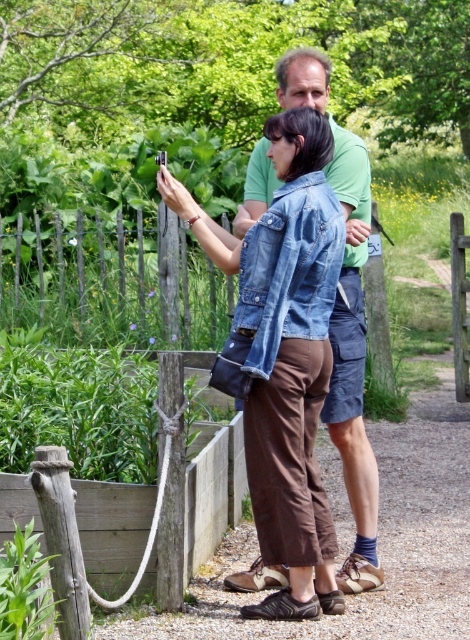
You are a photographer standing in the garden. You want to take a picture of the wooden fence at left without including the denim jacket at center in the shot. Is it possible to do so by moving to the left?

The wooden fence at left is positioned over denim jacket at center, meaning the fence is closer to the photographer. Moving to the left would bring the photographer closer to the fence, but since the fence is already in front of the denim jacket, it might still block the view. However, since the fence is at the left, moving further left could allow the photographer to frame the shot so the fence is visible without the jacket in the frame. It depends on the angle and distance. The answer isn

You are planning to hang a picture frame on the wooden fence at left. The frame is as tall as the denim jacket at lower right. Will the frame fit vertically on the fence without overlapping the top edge?

The wooden fence at left is above the denim jacket at lower right, meaning the fence is taller than the denim jacket. Since the frame is as tall as the denim jacket, it will fit vertically on the wooden fence at left without overlapping the top edge.